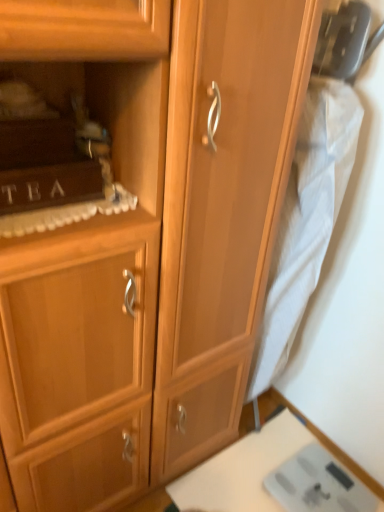
Locate an element on the screen. This screenshot has width=384, height=512. free point below white glossy table at lower right (from a real-world perspective) is located at coordinates (267, 483).